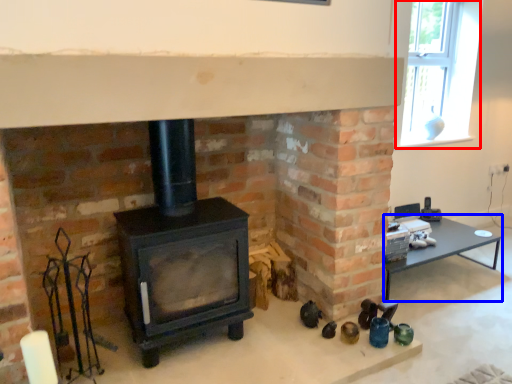
Question: Among these objects, which one is nearest to the camera, window (highlighted by a red box) or table (highlighted by a blue box)?

Choices:
 (A) window
 (B) table

Answer: (B)